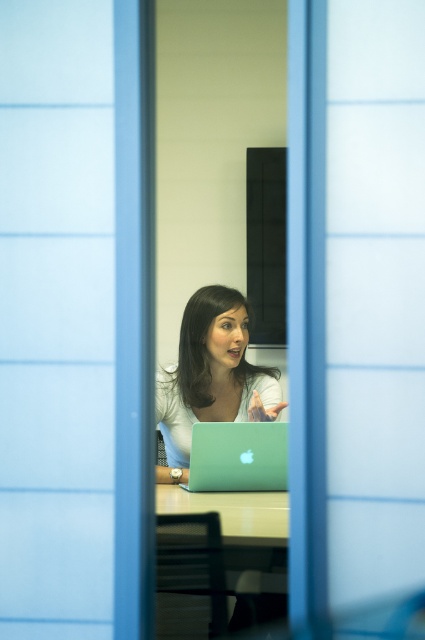
You are a delivery robot with a package that is 15 inches wide. You need to place the package between the matte green laptop at center and the light brown wooden table at center. Is there enough space to fit the package there?

The distance between the matte green laptop at center and the light brown wooden table at center is 14.98 inches. Since the package is 15 inches wide, it is slightly too wide to fit in the available space.

You are a visitor standing outside the office through the glass partition. You see the green glossy table at center and the green matte laptop at center. Which object is closer to the glass partition?

The green glossy table at center is closer to the glass partition because it is located below the green matte laptop at center, meaning the table is in front of the laptop from your perspective outside the office.

Consider the image. You are standing in front of the glass partition with blue framing. You see the green glossy table at center and the matte green laptop at center. Which object is closer to you?

The green glossy table at center is closer to the viewer than the matte green laptop at center.